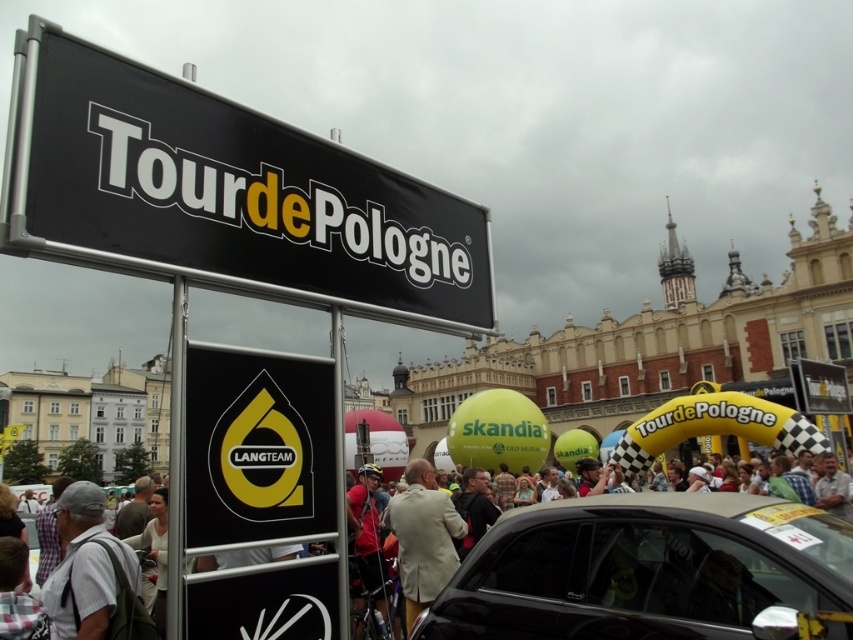
Who is positioned more to the right, black matte sign at upper left or light beige suit at center?

From the viewer's perspective, light beige suit at center appears more on the right side.

Does point (117, 253) come farther from viewer compared to point (426, 476)?

That is False.

You are a GUI agent. You are given a task and a screenshot of the screen. Output one action in this format:
    pyautogui.click(x=<x>, y=<y>)
    Task: Click on the black matte sign at upper left
    The image size is (853, 640).
    Given the screenshot: What is the action you would take?
    pyautogui.click(x=224, y=195)

This screenshot has width=853, height=640. What do you see at coordinates (647, 570) in the screenshot? I see `white cotton shirt at center` at bounding box center [647, 570].

Who is more distant from viewer, (682,621) or (231,449)?

The point (231,449) is more distant.

You are a GUI agent. You are given a task and a screenshot of the screen. Output one action in this format:
    pyautogui.click(x=<x>, y=<y>)
    Task: Click on the white cotton shirt at center
    The width and height of the screenshot is (853, 640).
    Given the screenshot: What is the action you would take?
    pyautogui.click(x=647, y=570)

Is white cotton shirt at center positioned at the back of black glossy car at center?

No, it is not.

Who is more forward, (604, 608) or (566, 518)?

Positioned in front is point (604, 608).

Is point (646, 541) closer to camera compared to point (767, 552)?

No, it is behind (767, 552).

Locate an element on the screen. This screenshot has width=853, height=640. white cotton shirt at center is located at coordinates (647, 570).